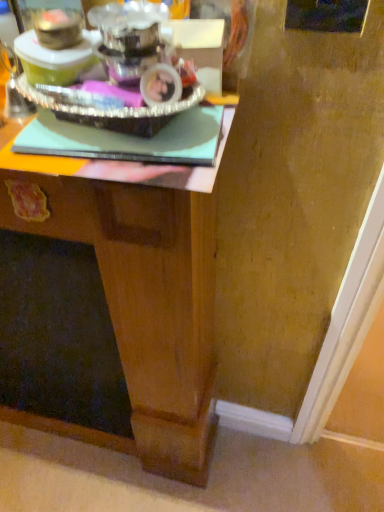
Question: From a real-world perspective, is wooden desk at center physically located above or below silver metallic tray at upper left?

Choices:
 (A) above
 (B) below

Answer: (B)

Question: Considering the positions of wooden desk at center and silver metallic tray at upper left in the image, is wooden desk at center taller or shorter than silver metallic tray at upper left?

Choices:
 (A) short
 (B) tall

Answer: (B)

Question: In the image, is wooden desk at center positioned in front of or behind silver metallic tray at upper left?

Choices:
 (A) behind
 (B) front

Answer: (A)

Question: From a real-world perspective, is silver metallic tray at upper left positioned above or below wooden desk at center?

Choices:
 (A) below
 (B) above

Answer: (B)

Question: Considering the positions of silver metallic tray at upper left and wooden desk at center in the image, is silver metallic tray at upper left wider or thinner than wooden desk at center?

Choices:
 (A) thin
 (B) wide

Answer: (A)

Question: In terms of height, does silver metallic tray at upper left look taller or shorter compared to wooden desk at center?

Choices:
 (A) tall
 (B) short

Answer: (B)

Question: In the image, is silver metallic tray at upper left positioned in front of or behind wooden desk at center?

Choices:
 (A) behind
 (B) front

Answer: (B)